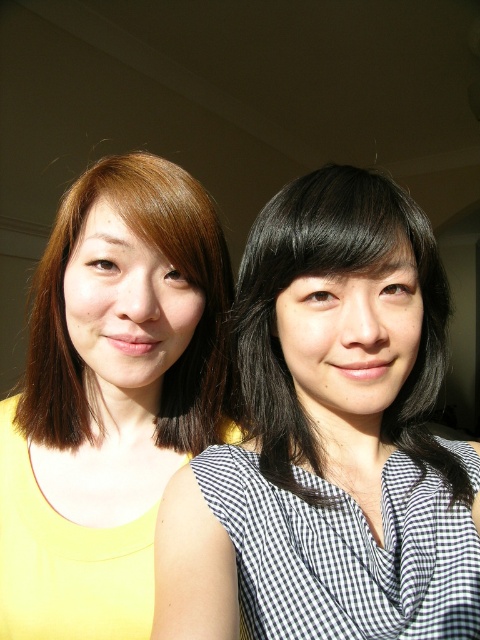
You are a photographer setting up for a photoshoot. You need to place a backdrop that is 2 meters wide. The backdrop must be positioned between the black checkered blouse at center and the yellow matte tank top at left. Given their widths, will the backdrop fit comfortably between them?

The black checkered blouse at center is wider than the yellow matte tank top at left. Since the backdrop is 2 meters wide, you need to ensure there is enough space between them. However, without knowing the exact distance between the two individuals, it is impossible to determine if the backdrop will fit comfortably.

You are a photographer setting up a shoot with two models wearing the black checkered blouse at center and the yellow matte tank top at left. The camera you are using has a minimum focus distance of 6 inches. Can you focus on both models simultaneously without adjusting the camera position?

The black checkered blouse at center and yellow matte tank top at left are 6.20 inches apart from each other. Since the camera requires a minimum focus distance of 6 inches, the 6.20 inches between them exceeds this requirement. Therefore, the camera can focus on both models simultaneously without needing to adjust the position.

You are a photographer setting up a photo shoot with two models wearing the black checkered blouse at center and the yellow matte tank top at left. You want to ensure that the tops are visible in the photos. Which model should you ask to stand closer to the camera to emphasize the length of their top?

The black checkered blouse at center is shorter than the yellow matte tank top at left, so to emphasize the length of the shorter top, you should ask the model wearing the black checkered blouse at center to stand closer to the camera.